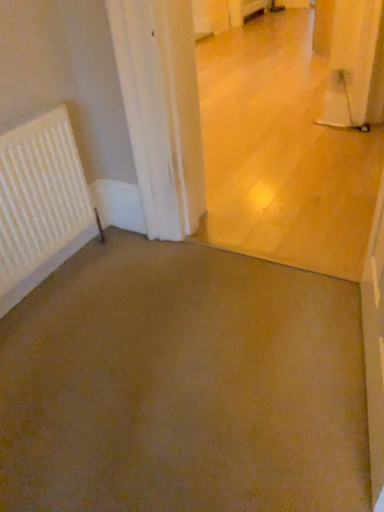
Locate an element on the screen. This screenshot has width=384, height=512. vacant space underneath white matte radiator at left (from a real-world perspective) is located at coordinates (61, 281).